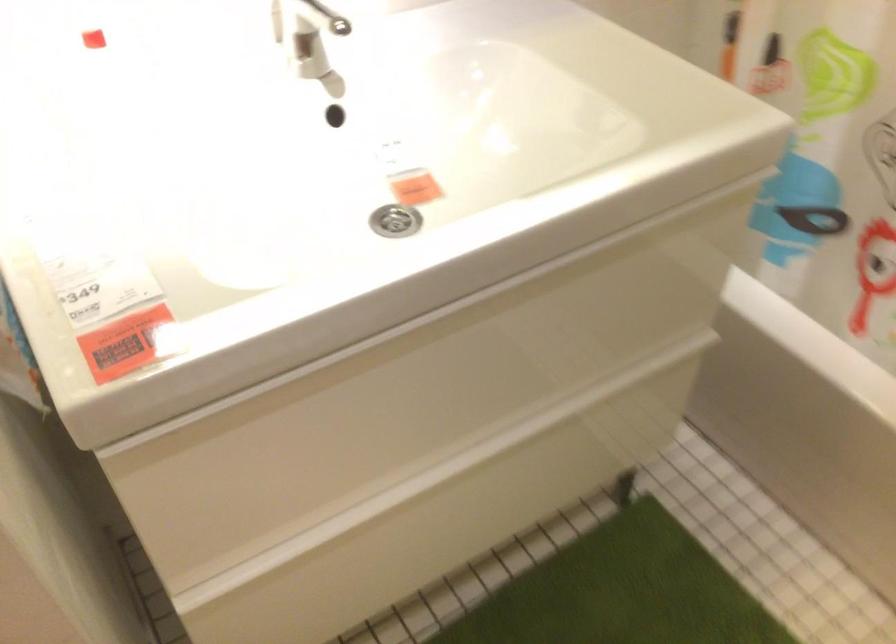
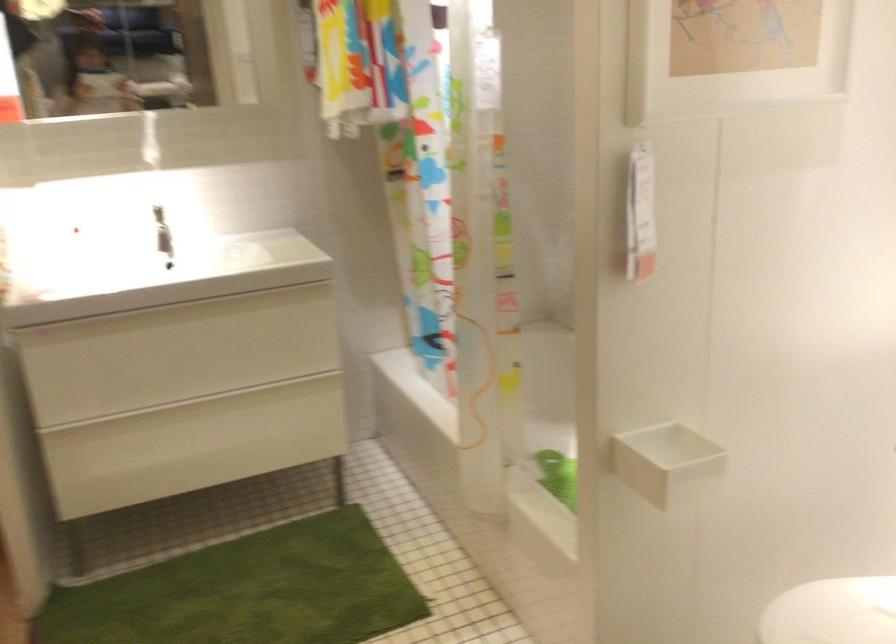
The images are taken continuously from a first-person perspective. In which direction are you moving?

The movement direction of the cameraman is right, backward.